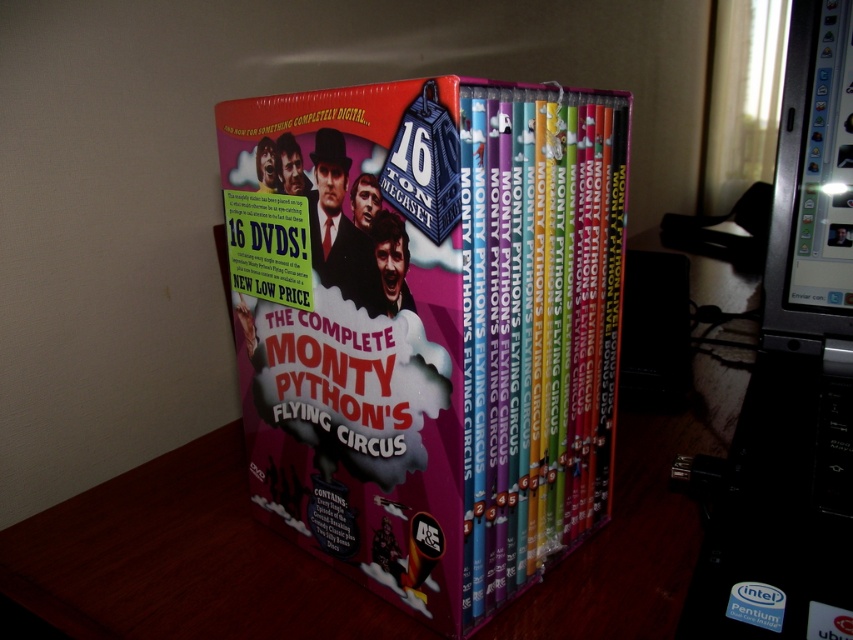
Question: Among these objects, which one is nearest to the camera?

Choices:
 (A) black plastic monitor at upper right
 (B) pink cardboard box at center

Answer: (A)

Question: Can you confirm if pink cardboard box at center is bigger than black plastic monitor at upper right?

Choices:
 (A) no
 (B) yes

Answer: (A)

Question: Can you confirm if pink cardboard box at center is positioned to the left of black plastic monitor at upper right?

Choices:
 (A) no
 (B) yes

Answer: (B)

Question: Where is pink cardboard box at center located in relation to black plastic monitor at upper right in the image?

Choices:
 (A) left
 (B) right

Answer: (A)

Question: Which point appears closest to the camera in this image?

Choices:
 (A) (251, 260)
 (B) (709, 577)

Answer: (B)